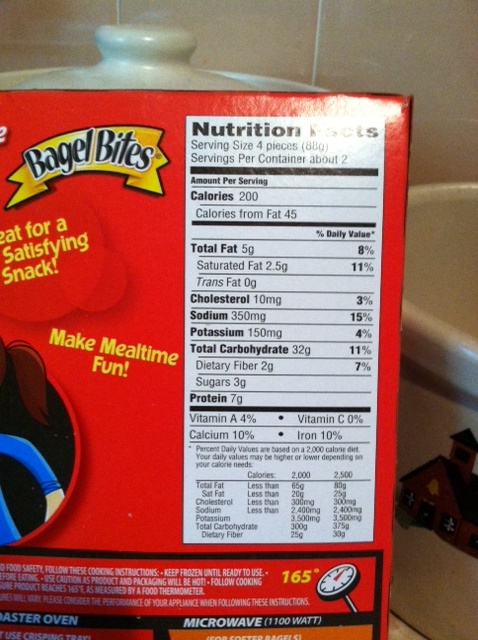
The height and width of the screenshot is (640, 478). What are the coordinates of `countertop` in the screenshot? It's located at (5, 534).